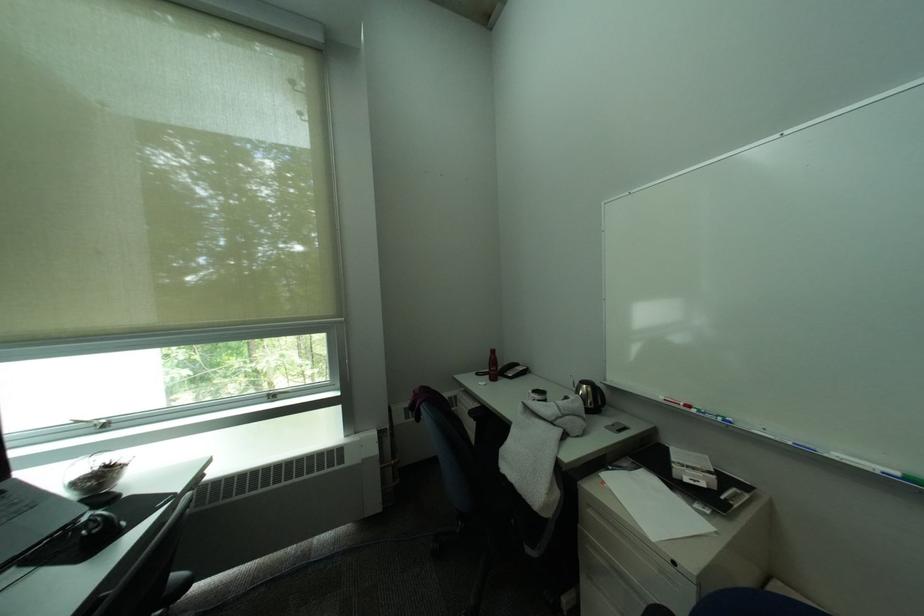
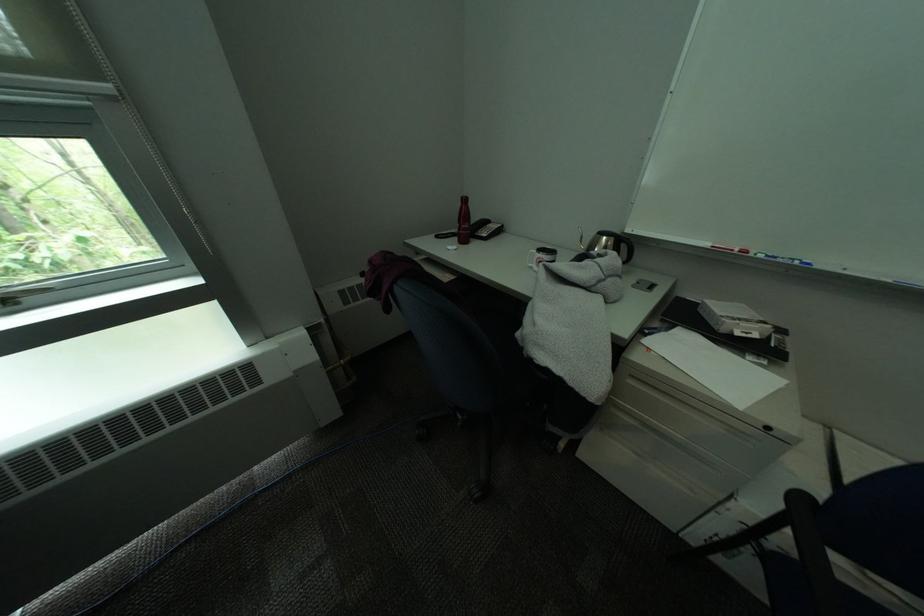
In the second image, find the point that corresponds to (499,379) in the first image.

(466, 241)